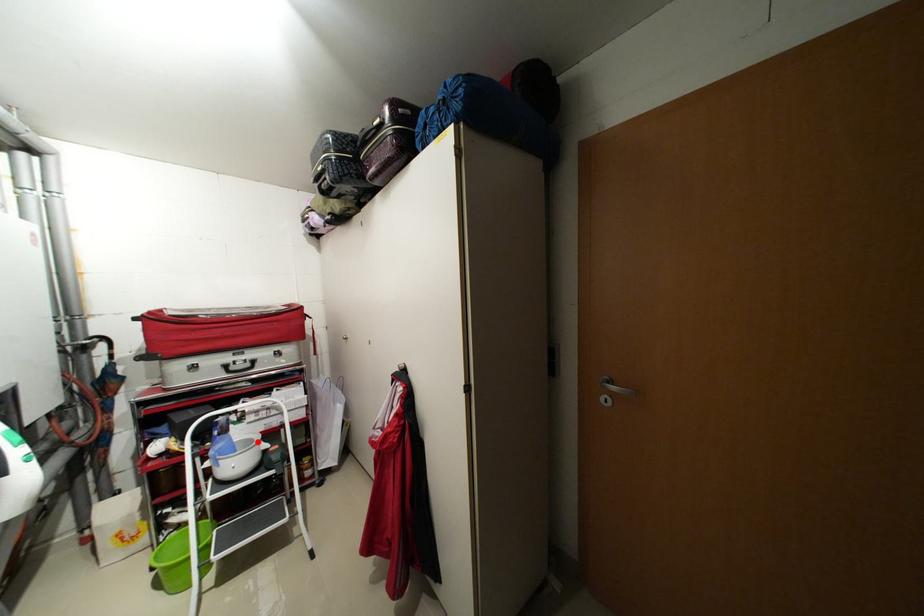
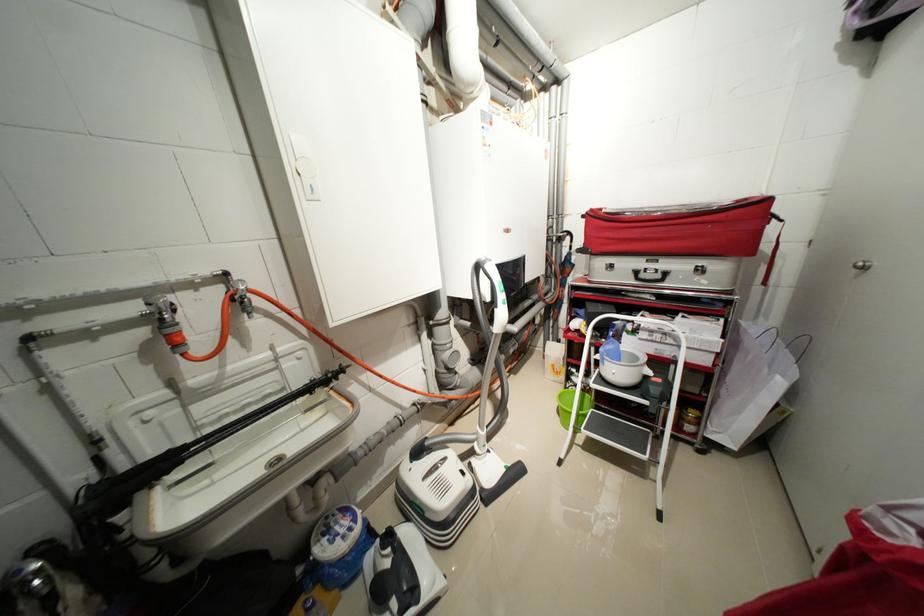
In the second image, find the point that corresponds to the highlighted location in the first image.

(642, 359)